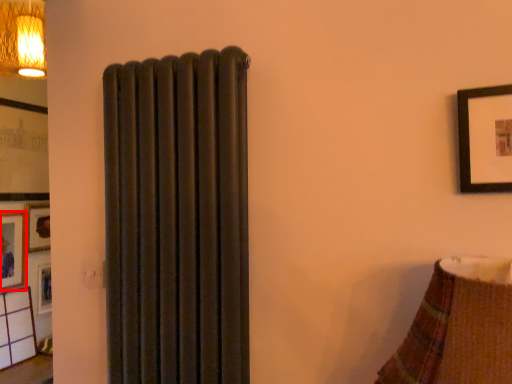
Question: From the image's perspective, where is picture frame (annotated by the red box) located relative to picture frame?

Choices:
 (A) above
 (B) below

Answer: (B)